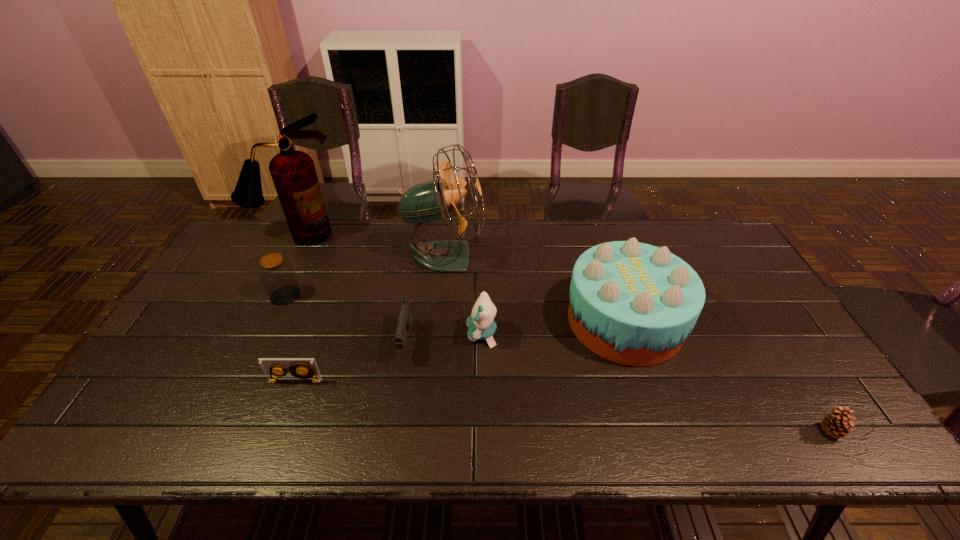
The height and width of the screenshot is (540, 960). Find the location of `free space between the sixth tallest object and the kitten`. free space between the sixth tallest object and the kitten is located at coordinates (444, 338).

Identify the location of vacant space that is in between the sixth tallest object and the videotape. Image resolution: width=960 pixels, height=540 pixels. (350, 361).

Locate an element on the screen. This screenshot has height=540, width=960. unoccupied position between the cake and the jar is located at coordinates (455, 308).

Locate an element on the screen. vacant area that lies between the cake and the kitten is located at coordinates (553, 328).

Locate which object ranks seventh in proximity to the fan. Please provide its 2D coordinates. Your answer should be formatted as a tuple, i.e. [(x, y)], where the tuple contains the x and y coordinates of a point satisfying the conditions above.

[(837, 423)]

Where is `object that is the fourth closest to the fire extinguisher`? This screenshot has height=540, width=960. object that is the fourth closest to the fire extinguisher is located at coordinates (301, 369).

Locate an element on the screen. The height and width of the screenshot is (540, 960). free spot that satisfies the following two spatial constraints: 1. at the nozzle of the second object from right to left; 2. on the left side of the fire extinguisher is located at coordinates (254, 321).

I want to click on vacant space that satisfies the following two spatial constraints: 1. on the front-facing side of the fan for air flow; 2. at the barrel of the third shortest object, so click(438, 341).

You are a GUI agent. You are given a task and a screenshot of the screen. Output one action in this format:
    pyautogui.click(x=<x>, y=<y>)
    Task: Click on the vacant space that satisfies the following two spatial constraints: 1. at the nozzle of the nearest object; 2. on the right side of the fire extinguisher
    The image size is (960, 540).
    Given the screenshot: What is the action you would take?
    tap(199, 431)